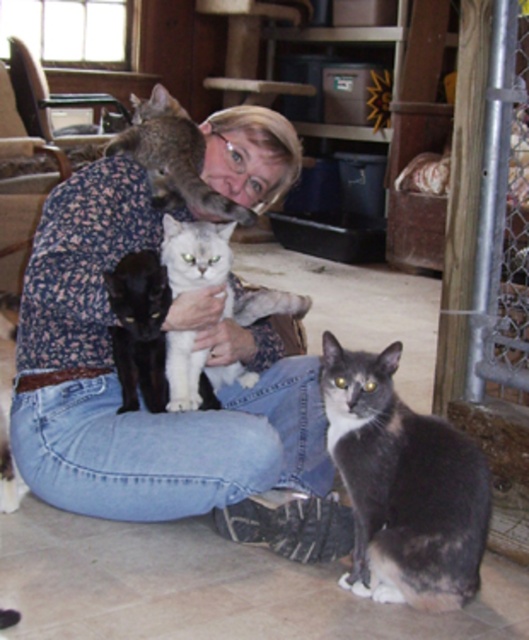
You are a cat lover visiting this home and want to know which cat is taller between the gray fur cat at center and the black fur cat at left. Can you tell me?

The gray fur cat at center is taller than the black fur cat at left.

You are a photographer standing 2 meters away from the camera. You want to take a photo of the white fluffy cat at center. Can you reach the cat without moving the camera?

The white fluffy cat at center and camera are 2.07 meters apart from each other. Since you are standing 2 meters away from the camera, you are 0.07 meters away from the cat. Therefore, you can reach the cat without moving the camera.

You are a photographer standing 2 meters away from the gray fur cat at center. You want to take a closeup photo of the cat. Can you reach the camera to focus on the cat without moving closer?

The gray fur cat at center and camera are 1.87 meters apart, so the photographer is already within the required distance to focus on the cat without moving closer.